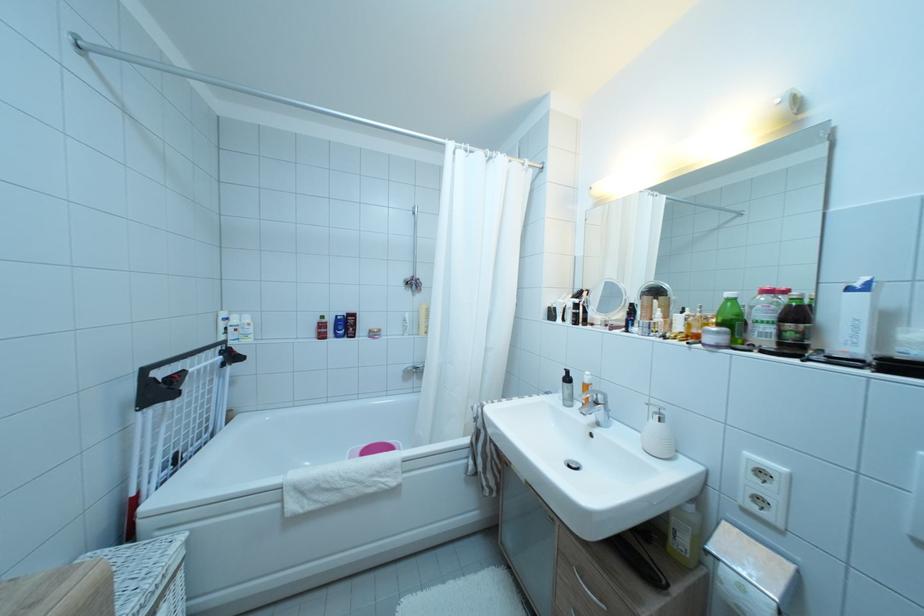
The height and width of the screenshot is (616, 924). What do you see at coordinates (596, 407) in the screenshot?
I see `a tub faucet handle` at bounding box center [596, 407].